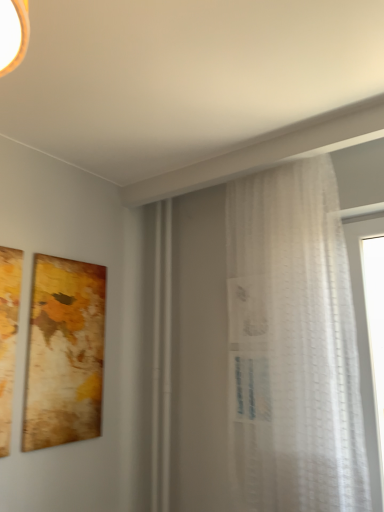
Question: Considering their positions, is white sheer curtain at right located in front of or behind matte gold picture frame at left?

Choices:
 (A) front
 (B) behind

Answer: (A)

Question: Considering the positions of white sheer curtain at right and matte gold picture frame at left in the image, is white sheer curtain at right wider or thinner than matte gold picture frame at left?

Choices:
 (A) thin
 (B) wide

Answer: (B)

Question: From a real-world perspective, is white sheer curtain at right positioned above or below matte gold picture frame at left?

Choices:
 (A) above
 (B) below

Answer: (A)

Question: Looking at the image, does matte gold picture frame at left seem bigger or smaller compared to white sheer curtain at right?

Choices:
 (A) small
 (B) big

Answer: (A)

Question: Is matte gold picture frame at left to the left or to the right of white sheer curtain at right in the image?

Choices:
 (A) right
 (B) left

Answer: (B)

Question: From a real-world perspective, is matte gold picture frame at left positioned above or below white sheer curtain at right?

Choices:
 (A) below
 (B) above

Answer: (A)

Question: Is matte gold picture frame at left in front of or behind white sheer curtain at right in the image?

Choices:
 (A) behind
 (B) front

Answer: (A)